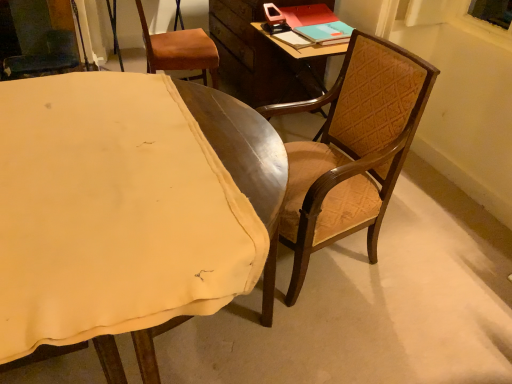
Question: Is wooden chair at center, which is counted as the 2th chair, starting from the back, looking in the opposite direction of teal matte book at upper right?

Choices:
 (A) no
 (B) yes

Answer: (A)

Question: Is wooden chair at center, which is counted as the 2th chair, starting from the back, shorter than teal matte book at upper right?

Choices:
 (A) yes
 (B) no

Answer: (B)

Question: Could you tell me if wooden chair at center, which is counted as the 2th chair, starting from the back, is turned towards teal matte book at upper right?

Choices:
 (A) yes
 (B) no

Answer: (B)

Question: Is wooden chair at center, which is counted as the 2th chair, starting from the back, smaller than teal matte book at upper right?

Choices:
 (A) no
 (B) yes

Answer: (A)

Question: Can you confirm if wooden chair at center, positioned as the second chair in front-to-back order, is positioned to the right of teal matte book at upper right?

Choices:
 (A) no
 (B) yes

Answer: (A)

Question: Visually, is brown leather chair at upper left, positioned as the first chair in back-to-front order, positioned to the left or to the right of teal matte book at upper right?

Choices:
 (A) right
 (B) left

Answer: (B)

Question: Based on their sizes in the image, would you say brown leather chair at upper left, positioned as the first chair in back-to-front order, is bigger or smaller than teal matte book at upper right?

Choices:
 (A) small
 (B) big

Answer: (B)

Question: Is point (211, 48) positioned closer to the camera than point (339, 41)?

Choices:
 (A) farther
 (B) closer

Answer: (A)

Question: In terms of height, does brown leather chair at upper left, positioned as the 3th chair in front-to-back order, look taller or shorter compared to teal matte book at upper right?

Choices:
 (A) tall
 (B) short

Answer: (A)

Question: Considering the positions of brown leather chair at upper left, positioned as the first chair in back-to-front order, and wooden chair at right, the first chair positioned from the front, in the image, is brown leather chair at upper left, positioned as the first chair in back-to-front order, wider or thinner than wooden chair at right, the first chair positioned from the front,?

Choices:
 (A) thin
 (B) wide

Answer: (A)

Question: In terms of size, does brown leather chair at upper left, positioned as the 3th chair in front-to-back order, appear bigger or smaller than wooden chair at right, the first chair positioned from the front?

Choices:
 (A) small
 (B) big

Answer: (A)

Question: In terms of height, does brown leather chair at upper left, positioned as the first chair in back-to-front order, look taller or shorter compared to wooden chair at right, the first chair positioned from the front?

Choices:
 (A) short
 (B) tall

Answer: (B)

Question: From the image's perspective, is brown leather chair at upper left, positioned as the first chair in back-to-front order, above or below wooden chair at right, which is the third chair from back to front?

Choices:
 (A) above
 (B) below

Answer: (A)

Question: In the image, is wooden chair at center, which is counted as the 2th chair, starting from the back, positioned in front of or behind wooden chair at right, which is the third chair from back to front?

Choices:
 (A) front
 (B) behind

Answer: (B)

Question: From the image's perspective, relative to wooden chair at right, which is the third chair from back to front, is wooden chair at center, which is counted as the 2th chair, starting from the back, above or below?

Choices:
 (A) below
 (B) above

Answer: (B)